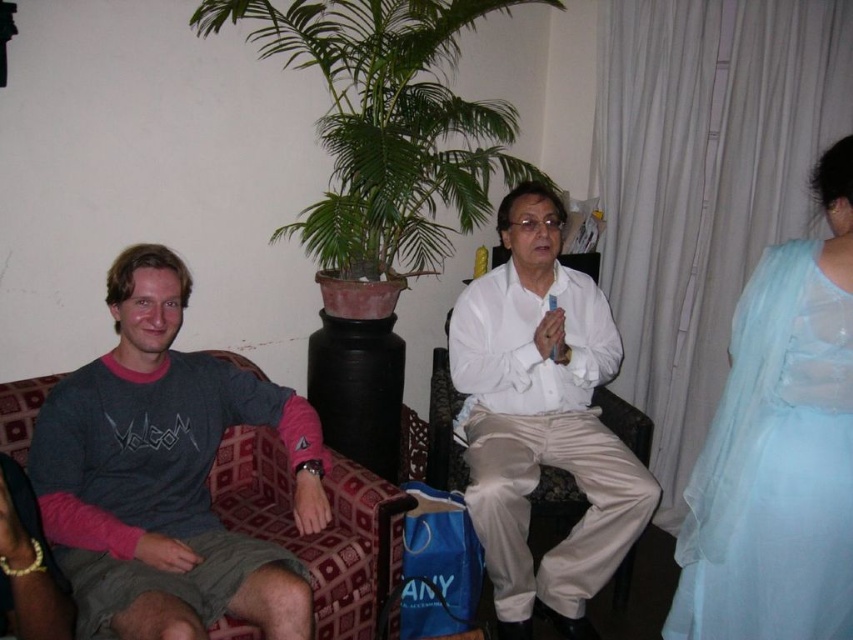
Is light blue sheer fabric at right positioned at the back of white satin pants at center?

No, light blue sheer fabric at right is closer to the viewer.

Who is more forward, (746, 387) or (488, 292)?

Positioned in front is point (746, 387).

Who is more distant from viewer, (697,493) or (624,545)?

Positioned behind is point (624,545).

This screenshot has width=853, height=640. I want to click on light blue sheer fabric at right, so click(779, 449).

Which of these two, gray cotton shirt at left or light blue sheer fabric at right, stands shorter?

gray cotton shirt at left

Can you confirm if gray cotton shirt at left is shorter than light blue sheer fabric at right?

Yes.

Describe the element at coordinates (166, 476) in the screenshot. I see `gray cotton shirt at left` at that location.

Locate an element on the screen. gray cotton shirt at left is located at coordinates (166, 476).

Between gray cotton shirt at left and white satin pants at center, which one is positioned lower?

Positioned lower is gray cotton shirt at left.

Between gray cotton shirt at left and white satin pants at center, which one has less height?

With less height is gray cotton shirt at left.

Which is in front, point (248, 378) or point (610, 566)?

Point (248, 378)

At what (x,y) coordinates should I click in order to perform the action: click on gray cotton shirt at left. Please return your answer as a coordinate pair (x, y). Looking at the image, I should click on (166, 476).